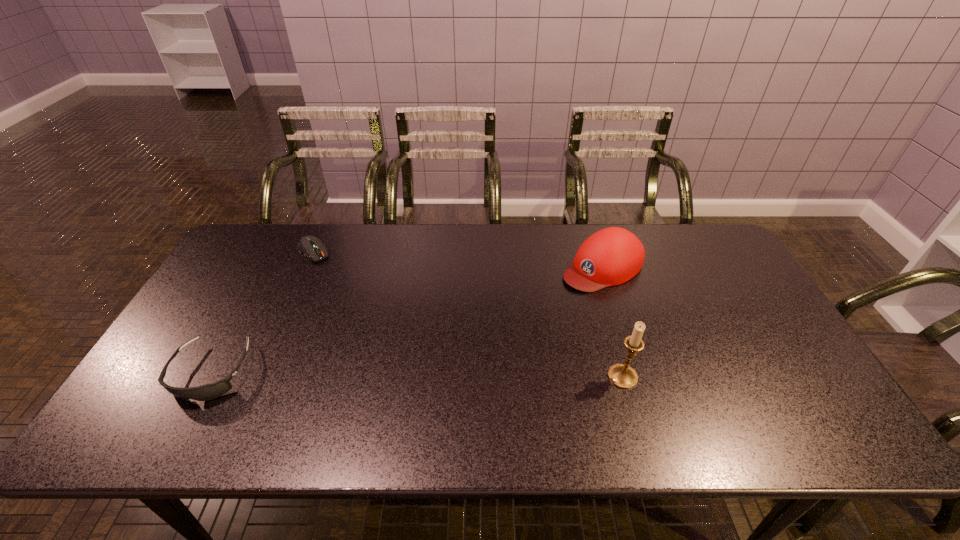
Image resolution: width=960 pixels, height=540 pixels. I want to click on goggles, so click(x=210, y=391).

Where is `the tallest object`? This screenshot has height=540, width=960. the tallest object is located at coordinates (621, 375).

This screenshot has width=960, height=540. What are the coordinates of `baseball cap` in the screenshot? It's located at (612, 256).

Image resolution: width=960 pixels, height=540 pixels. What are the coordinates of `the shortest object` in the screenshot? It's located at (x=310, y=246).

I want to click on vacant area situated 0.380m on the right of the tallest object, so click(790, 376).

I want to click on vacant region located on the front-facing side of the second tallest object, so click(553, 296).

The width and height of the screenshot is (960, 540). In order to click on vacant point located on the front-facing side of the second tallest object in this screenshot , I will do `click(489, 337)`.

Locate an element on the screen. This screenshot has width=960, height=540. blank space located 0.310m on the front-facing side of the second tallest object is located at coordinates (497, 332).

You are a GUI agent. You are given a task and a screenshot of the screen. Output one action in this format:
    pyautogui.click(x=<x>, y=<y>)
    Task: Click on the vacant region located 0.060m on the button of the computer equipment
    
    Given the screenshot: What is the action you would take?
    pyautogui.click(x=330, y=271)

This screenshot has height=540, width=960. What are the coordinates of `vacant space located 0.300m on the button of the computer equipment` in the screenshot? It's located at (368, 312).